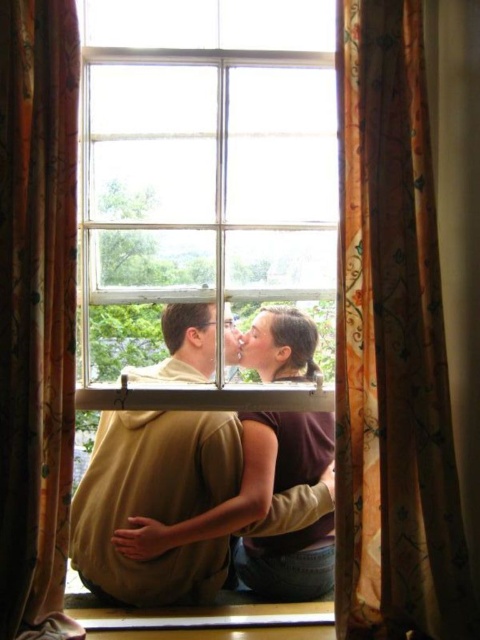
Does floral silk curtain at right have a smaller size compared to brown fabric hair at center?

Actually, floral silk curtain at right might be larger than brown fabric hair at center.

Between floral silk curtain at right and brown fabric hair at center, which one appears on the left side from the viewer's perspective?

brown fabric hair at center

Does point (367, 470) lie in front of point (249, 442)?

Yes, point (367, 470) is closer to viewer.

At what (x,y) coordinates should I click in order to perform the action: click on floral silk curtain at right. Please return your answer as a coordinate pair (x, y). Looking at the image, I should click on (392, 348).

Measure the distance between floral patterned fabric curtain at center and camera.

They are 4.40 feet apart.

Can you confirm if floral patterned fabric curtain at center is wider than brown fabric hair at center?

Incorrect, floral patterned fabric curtain at center's width does not surpass brown fabric hair at center's.

This screenshot has width=480, height=640. What do you see at coordinates (36, 310) in the screenshot?
I see `floral patterned fabric curtain at center` at bounding box center [36, 310].

Locate an element on the screen. floral patterned fabric curtain at center is located at coordinates (36, 310).

Based on the photo, is clear glass window at center positioned before brown fabric hair at center?

Yes, clear glass window at center is in front of brown fabric hair at center.

Can you confirm if clear glass window at center is positioned to the right of brown fabric hair at center?

In fact, clear glass window at center is to the left of brown fabric hair at center.

Between point (169, 177) and point (294, 326), which one is positioned in front?

Point (169, 177) is more forward.

Where is `clear glass window at center`? This screenshot has width=480, height=640. clear glass window at center is located at coordinates (205, 150).